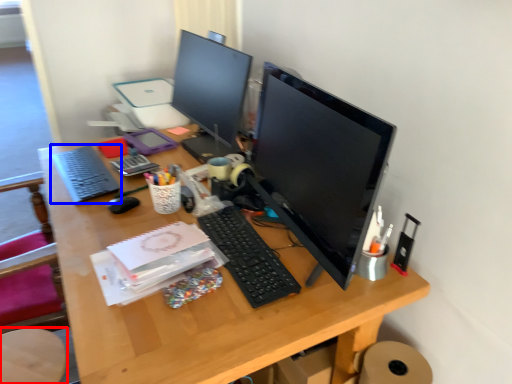
Question: Which object is further to the camera taking this photo, computer chair (highlighted by a red box) or computer keyboard (highlighted by a blue box)?

Choices:
 (A) computer chair
 (B) computer keyboard

Answer: (B)